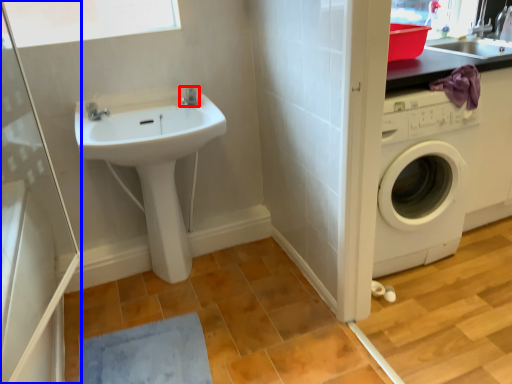
Question: Which of the following is the farthest to the observer, tap (highlighted by a red box) or screen door (highlighted by a blue box)?

Choices:
 (A) tap
 (B) screen door

Answer: (A)